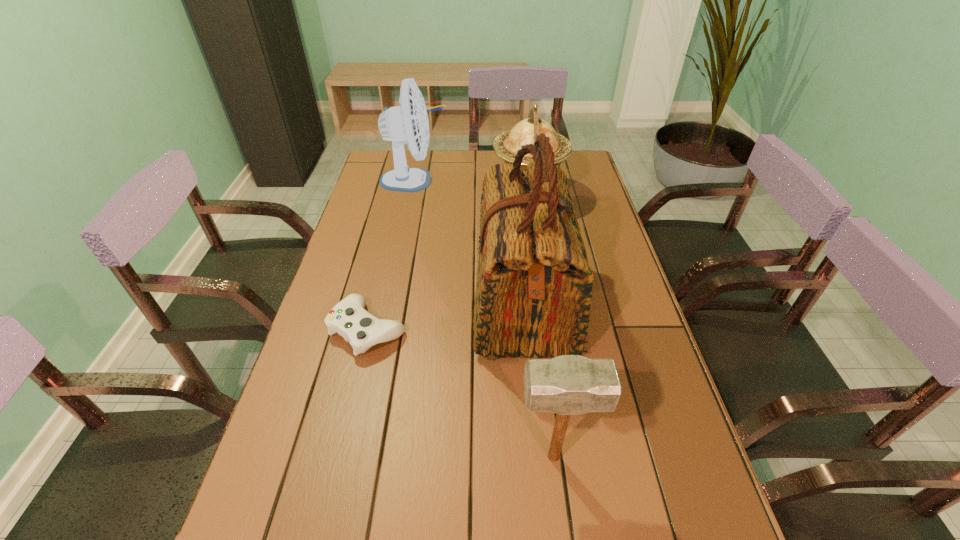
At what (x,y) coordinates should I click in order to perform the action: click on free space between the shortest object and the shopping bag. Please return your answer as a coordinate pair (x, y). This screenshot has width=960, height=540. Looking at the image, I should click on (446, 315).

The height and width of the screenshot is (540, 960). Identify the location of unoccupied area between the globe and the fan. pyautogui.click(x=471, y=187).

I want to click on vacant region between the fan and the tallest object, so click(469, 241).

Identify which object is the fourth closest to the nearest object. Please provide its 2D coordinates. Your answer should be formatted as a tuple, i.e. [(x, y)], where the tuple contains the x and y coordinates of a point satisfying the conditions above.

[(408, 123)]

Find the location of `the fourth closest object relative to the shortest object`. the fourth closest object relative to the shortest object is located at coordinates (408, 123).

Where is `free space that satisfies the following two spatial constraints: 1. on the grille of the fan; 2. on the front side of the shortest object`? free space that satisfies the following two spatial constraints: 1. on the grille of the fan; 2. on the front side of the shortest object is located at coordinates (384, 329).